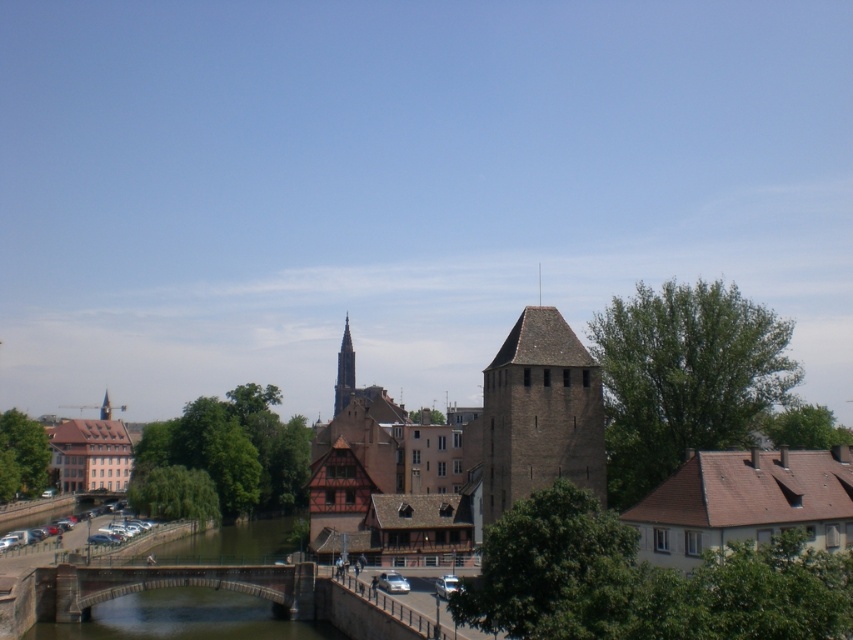
Is point (149, 586) positioned before point (352, 353)?

Yes.

Which is above, concrete stone bridge at lower center or smooth stone tower at center?

smooth stone tower at center

Is point (71, 621) farther from camera compared to point (343, 348)?

That is False.

Where is `concrete stone bridge at lower center`? This screenshot has height=640, width=853. concrete stone bridge at lower center is located at coordinates (167, 586).

Is brown brick tower at center positioned behind concrete stone bridge at lower center?

That is False.

Does brown brick tower at center have a lesser width compared to concrete stone bridge at lower center?

Yes, brown brick tower at center is thinner than concrete stone bridge at lower center.

Locate an element on the screen. The image size is (853, 640). brown brick tower at center is located at coordinates (540, 413).

Is brown brick tower at center closer to camera compared to smooth stone tower at center?

Yes.

Does point (514, 493) come closer to viewer compared to point (339, 349)?

Yes.

Does point (534, 388) come in front of point (339, 384)?

That is True.

Locate an element on the screen. The height and width of the screenshot is (640, 853). brown brick tower at center is located at coordinates (540, 413).